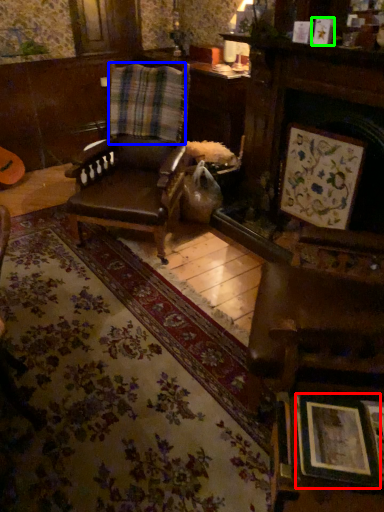
Question: Which is farther away from picture frame (highlighted by a red box)? curtain (highlighted by a blue box) or picture frame (highlighted by a green box)?

Choices:
 (A) curtain
 (B) picture frame

Answer: (A)